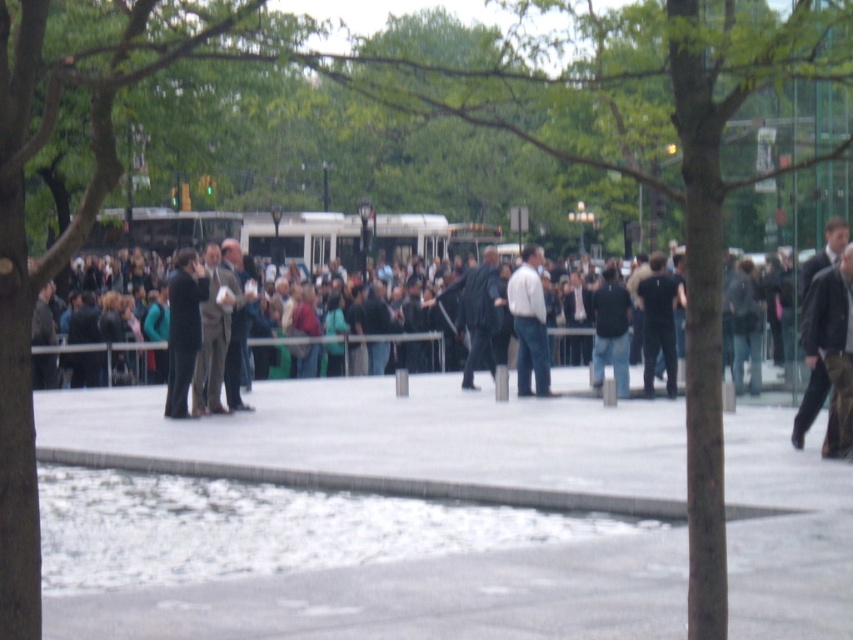
Is point (647, 353) farther from camera compared to point (619, 323)?

No, (647, 353) is closer to viewer.

Which is above, black matte shirt at center or dark gray jacket at center?

black matte shirt at center is higher up.

Locate an element on the screen. The width and height of the screenshot is (853, 640). black matte shirt at center is located at coordinates (659, 321).

Find the location of a particular element. Image resolution: width=853 pixels, height=640 pixels. black matte shirt at center is located at coordinates (659, 321).

Which is above, white shirt at center or dark gray jacket at center?

white shirt at center is higher up.

Is white shirt at center smaller than dark gray jacket at center?

Yes, white shirt at center is smaller than dark gray jacket at center.

Does point (537, 346) come behind point (618, 374)?

No, it is in front of (618, 374).

This screenshot has width=853, height=640. I want to click on white shirt at center, so click(529, 323).

Which is in front, point (169, 330) or point (529, 368)?

Point (169, 330) is more forward.

Does dark suit at center appear under white shirt at center?

Indeed, dark suit at center is positioned under white shirt at center.

Find the location of a particular element. This screenshot has height=640, width=853. dark suit at center is located at coordinates (183, 328).